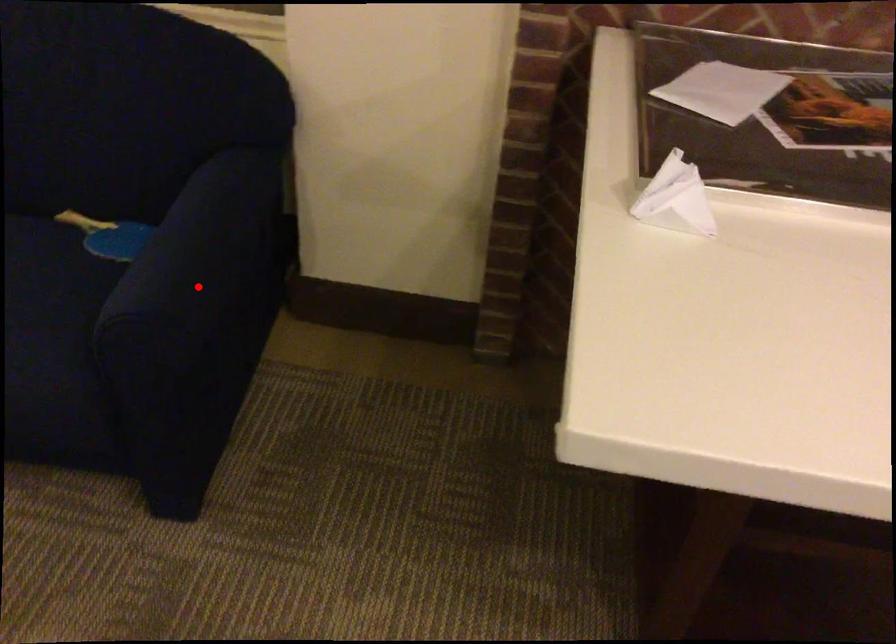
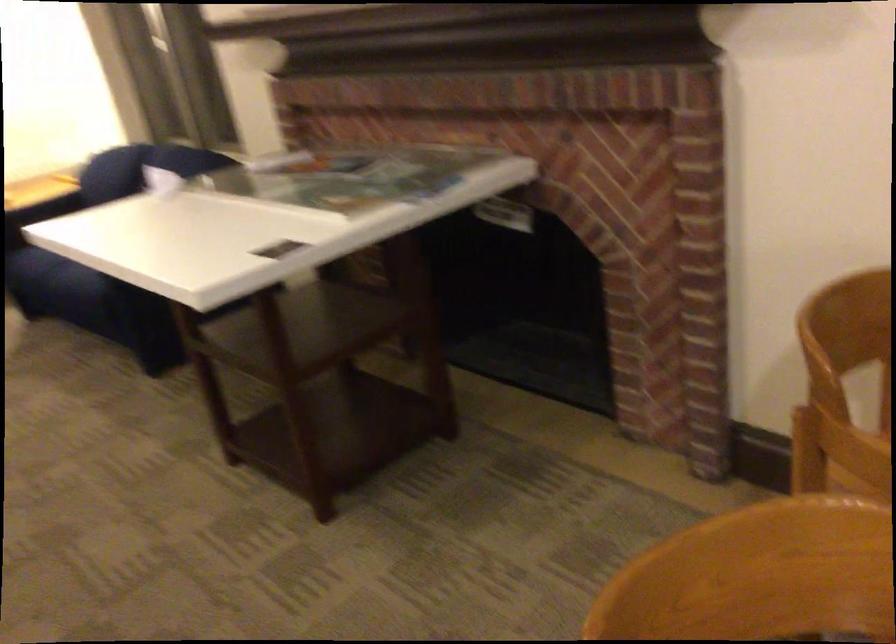
Question: I am providing you with two images of the same scene from different viewpoints. A red point is marked on the first image. At the location where the point appears in image 1, is it still visible in image 2?

Choices:
 (A) Yes
 (B) No

Answer: (B)